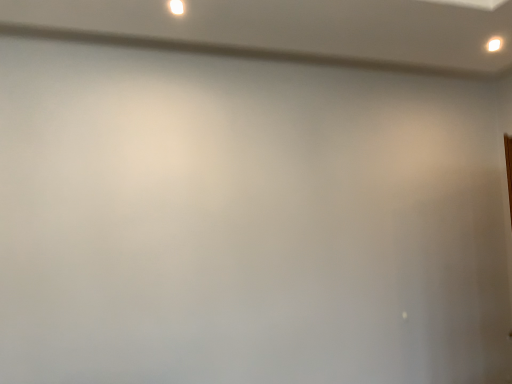
Question: In terms of size, does white glossy light at upper right, which appears as the second light when viewed from the front, appear bigger or smaller than white glossy light at upper center, which appears as the first light when viewed from the left?

Choices:
 (A) small
 (B) big

Answer: (B)

Question: Considering the positions of white glossy light at upper right, the first light from the right, and white glossy light at upper center, which appears as the first light when viewed from the left, in the image, is white glossy light at upper right, the first light from the right, taller or shorter than white glossy light at upper center, which appears as the first light when viewed from the left,?

Choices:
 (A) short
 (B) tall

Answer: (B)

Question: Do you think white glossy light at upper right, the first light positioned from the back, is within white glossy light at upper center, the second light viewed from the right, or outside of it?

Choices:
 (A) outside
 (B) inside

Answer: (A)

Question: Is white glossy light at upper center, placed as the 2th light when sorted from back to front, wider or thinner than white glossy light at upper right, the first light from the right?

Choices:
 (A) wide
 (B) thin

Answer: (A)

Question: Choose the correct answer: Is white glossy light at upper center, the second light viewed from the right, inside white glossy light at upper right, which appears as the second light when viewed from the front, or outside it?

Choices:
 (A) inside
 (B) outside

Answer: (B)

Question: Considering the positions of point (182, 8) and point (490, 49), is point (182, 8) closer or farther from the camera than point (490, 49)?

Choices:
 (A) closer
 (B) farther

Answer: (A)

Question: Considering the positions of white glossy light at upper center, the second light viewed from the right, and white glossy light at upper right, the first light positioned from the back, in the image, is white glossy light at upper center, the second light viewed from the right, taller or shorter than white glossy light at upper right, the first light positioned from the back,?

Choices:
 (A) short
 (B) tall

Answer: (A)